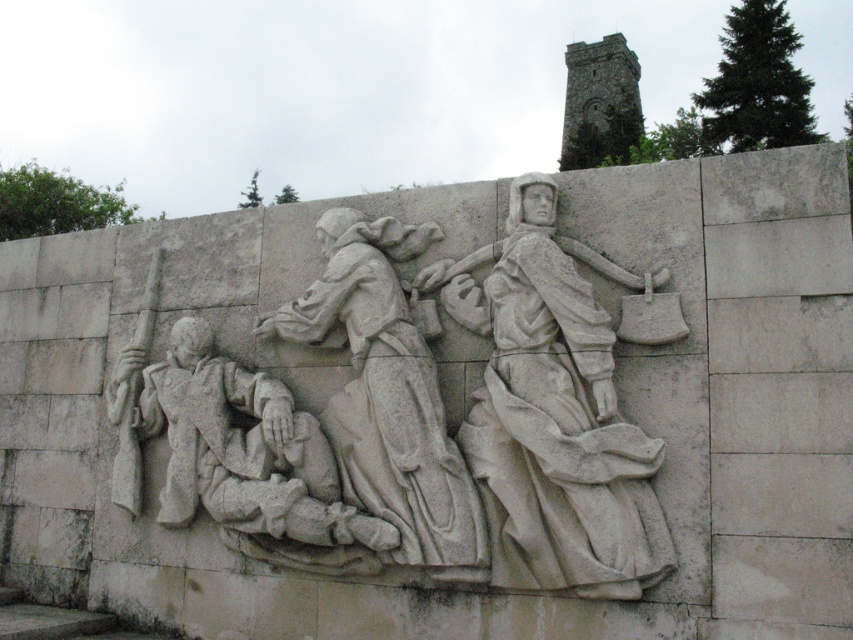
Which of these two, white stone figure at center or gray stone soldier at center, stands shorter?

gray stone soldier at center

Does white stone figure at center have a greater height compared to gray stone soldier at center?

Indeed, white stone figure at center has a greater height compared to gray stone soldier at center.

Is point (666, 278) more distant than point (287, 509)?

That is False.

Image resolution: width=853 pixels, height=640 pixels. In order to click on white stone figure at center in this screenshot , I will do `click(553, 412)`.

Which is below, white stone relief at center or gray stone soldier at center?

gray stone soldier at center is lower down.

Can you confirm if white stone relief at center is shorter than gray stone soldier at center?

No, white stone relief at center is not shorter than gray stone soldier at center.

This screenshot has width=853, height=640. Identify the location of white stone relief at center. (418, 404).

Is the position of white stone relief at center less distant than that of white stone figure at center?

No, it is not.

Looking at this image, measure the distance between point [329,556] and camera.

Point [329,556] is 17.84 meters from camera.

This screenshot has width=853, height=640. What are the coordinates of `white stone relief at center` in the screenshot? It's located at (418, 404).